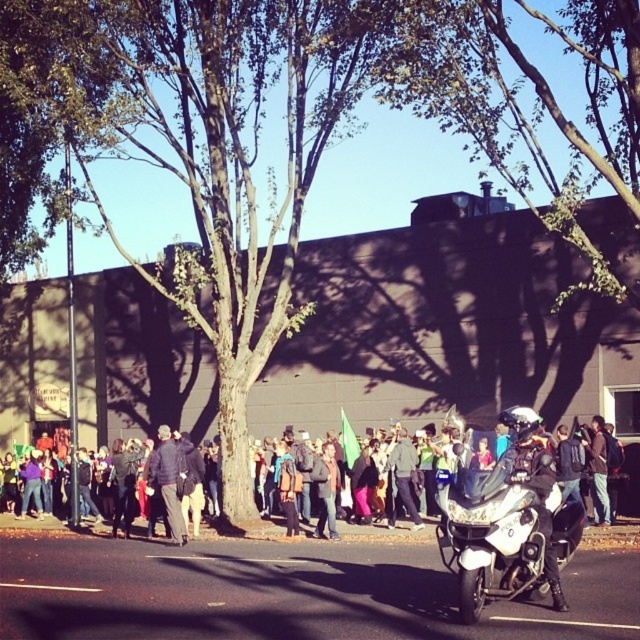
Question: Is white matte motorcycle at right further to the viewer compared to black rubber line at lower center?

Choices:
 (A) no
 (B) yes

Answer: (B)

Question: Which object appears closest to the camera in this image?

Choices:
 (A) dark gray jacket at center
 (B) black rubber line at lower center
 (C) white glossy motorcycle at center

Answer: (B)

Question: Where is white glossy motorcycle at center located in relation to black rubber line at lower center in the image?

Choices:
 (A) right
 (B) left

Answer: (B)

Question: Which point is farther to the camera?

Choices:
 (A) dark gray jacket at center
 (B) white matte motorcycle at right

Answer: (A)

Question: Which point is closer to the camera?

Choices:
 (A) (36, 531)
 (B) (483, 536)
 (C) (541, 504)

Answer: (B)

Question: Does dark gray jacket at center come behind black rubber line at lower center?

Choices:
 (A) no
 (B) yes

Answer: (B)